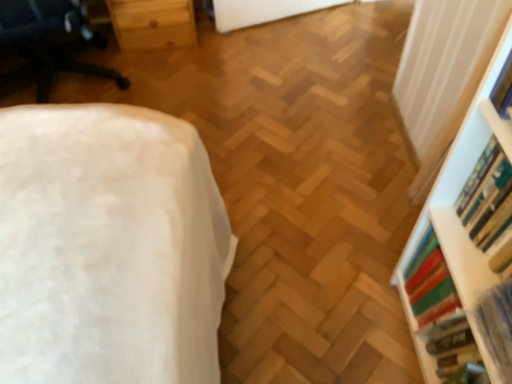
Question: Is hardcover book at right, acting as the 2th book starting from the top, wider or thinner than white plastic shelf at right?

Choices:
 (A) thin
 (B) wide

Answer: (A)

Question: Considering their positions, is hardcover book at right, acting as the 2th book starting from the top, located in front of or behind white plastic shelf at right?

Choices:
 (A) behind
 (B) front

Answer: (A)

Question: Which object is the farthest from the hardcover book at right, marked as the 2th book in a bottom-to-top arrangement?

Choices:
 (A) hardcover book at upper right, arranged as the 1th book when viewed from the top
 (B) white fabric ottoman at left
 (C) hardcover book at right, which is the first book in bottom-to-top order
 (D) white plastic shelf at right
 (E) hardcover book at right, acting as the 2th book starting from the top

Answer: (B)

Question: Which object is positioned closest to the hardcover book at right, which is the first book in bottom-to-top order?

Choices:
 (A) hardcover book at right, marked as the 2th book in a bottom-to-top arrangement
 (B) white plastic shelf at right
 (C) white fabric ottoman at left
 (D) hardcover book at upper right, which is the 4th book from bottom to top
 (E) hardcover book at right, acting as the 2th book starting from the top

Answer: (E)